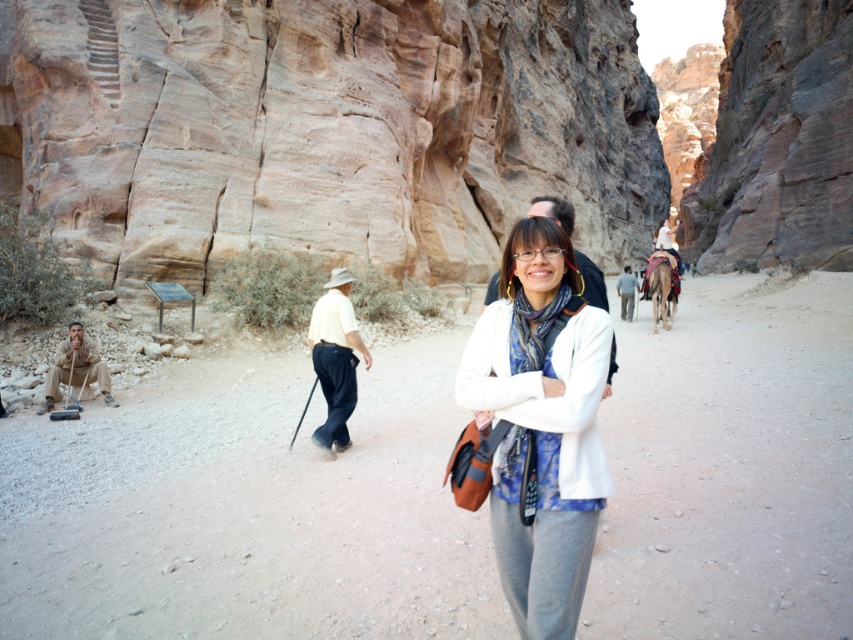
Question: Which object is farther from the camera taking this photo?

Choices:
 (A) white matte jacket at center
 (B) camouflage fabric uniform at lower left

Answer: (B)

Question: Which object is the closest to the white shirt at center?

Choices:
 (A) white matte jacket at center
 (B) light yellow cotton shirt at center
 (C) rustic stone wall at center

Answer: (A)

Question: Does camouflage fabric uniform at lower left have a lesser width compared to white shirt at center?

Choices:
 (A) no
 (B) yes

Answer: (B)

Question: Is rustic stone wall at center wider than light yellow cotton shirt at center?

Choices:
 (A) no
 (B) yes

Answer: (B)

Question: Considering the real-world distances, which object is closest to the light blue jeans at center?

Choices:
 (A) white matte jacket at center
 (B) rustic stone wall at center

Answer: (A)

Question: In this image, where is camouflage fabric uniform at lower left located relative to white shirt at center?

Choices:
 (A) left
 (B) right

Answer: (A)